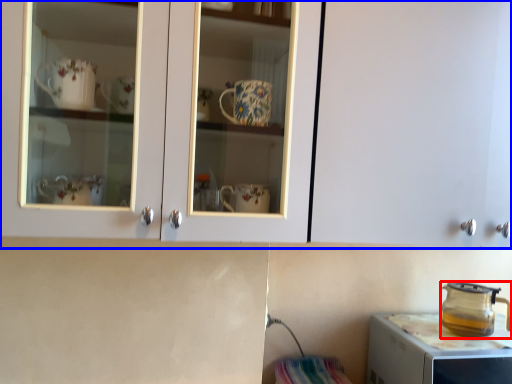
Question: Which object appears farthest to the camera in this image, kitchen appliance (highlighted by a red box) or cabinetry (highlighted by a blue box)?

Choices:
 (A) kitchen appliance
 (B) cabinetry

Answer: (A)